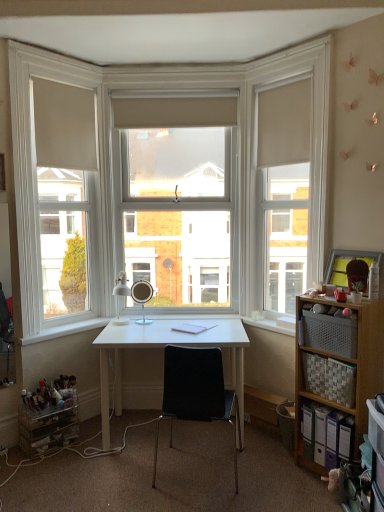
You are a GUI agent. You are given a task and a screenshot of the screen. Output one action in this format:
    pyautogui.click(x=<x>, y=<y>)
    Task: Click on the vacant area that is situated to the right of black plastic chair at center
    Image resolution: width=384 pixels, height=512 pixels.
    Given the screenshot: What is the action you would take?
    pyautogui.click(x=268, y=478)